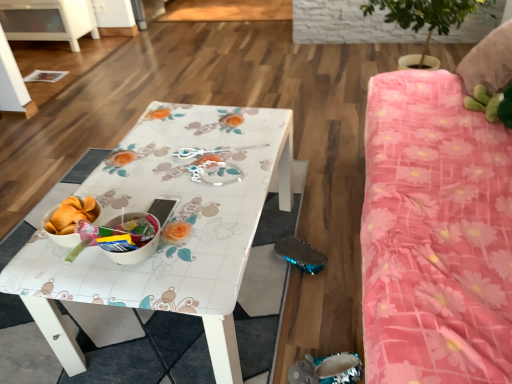
Where is `vacant region above white glossy table at center (from a real-world perspective)`? The width and height of the screenshot is (512, 384). vacant region above white glossy table at center (from a real-world perspective) is located at coordinates (192, 163).